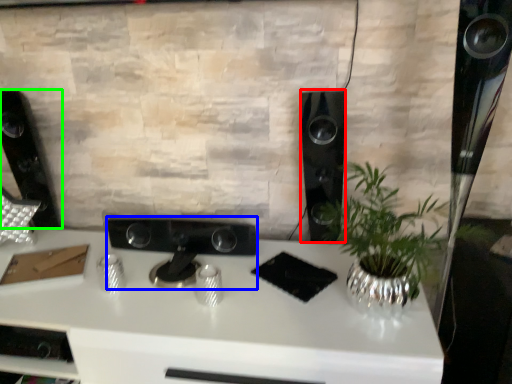
Question: Which object is positioned closest to speaker (highlighted by a red box)? Select from appliance (highlighted by a blue box) and speaker (highlighted by a green box).

Choices:
 (A) appliance
 (B) speaker

Answer: (A)